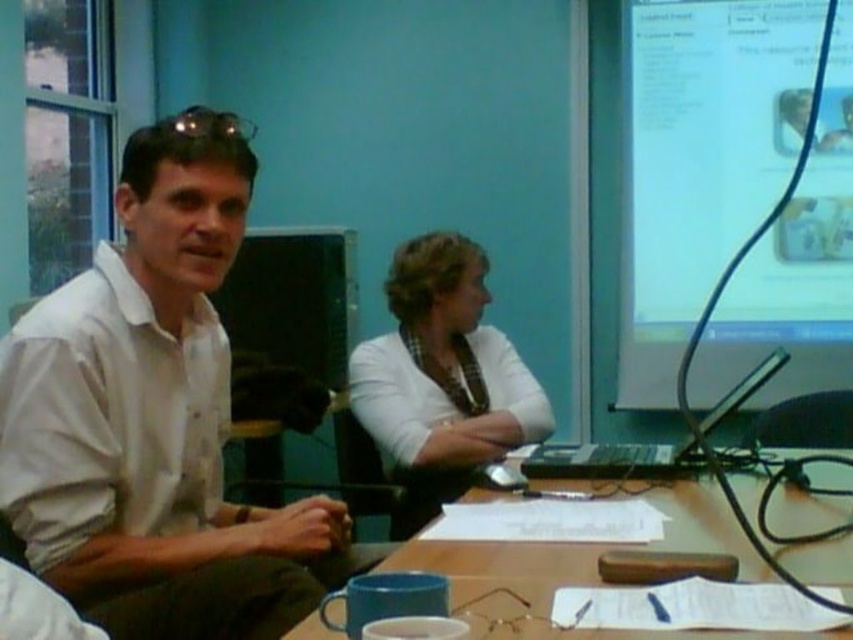
Question: Which is farther from the white cotton shirt at left?

Choices:
 (A) white matte shirt at center
 (B) wooden table at center
 (C) matte plastic projector screen at upper right

Answer: (C)

Question: Which of the following is the closest to the observer?

Choices:
 (A) (440, 264)
 (B) (770, 387)

Answer: (A)

Question: Estimate the real-world distances between objects in this image. Which object is closer to the black plastic computer at center?

Choices:
 (A) wooden table at center
 (B) white matte shirt at center
 (C) white cotton shirt at left

Answer: (A)

Question: Is matte plastic projector screen at upper right bigger than white matte shirt at center?

Choices:
 (A) yes
 (B) no

Answer: (A)

Question: In this image, where is white cotton shirt at left located relative to white matte shirt at center?

Choices:
 (A) above
 (B) below

Answer: (A)

Question: Does white cotton shirt at left appear over black plastic computer at center?

Choices:
 (A) yes
 (B) no

Answer: (A)